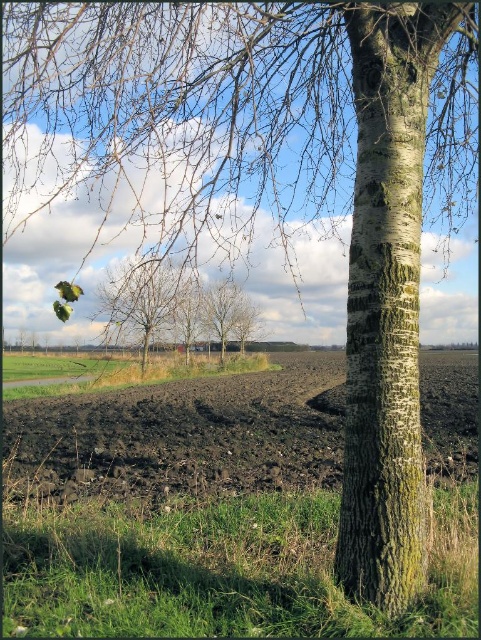
You are a farmer planning to plant a row of crops between the bare branches at center and the smooth bark tree at center. Based on the space between them, will you have enough room to plant your crops in a straight line without bending the branches?

The bare branches at center are wider than the smooth bark tree at center, so there is sufficient space between them to plant crops in a straight line without bending the branches.

You are a gardener planning to plant flowers around the barky white tree trunk at right and the bare branches at center. Which area requires more space for planting?

The bare branches at center occupy more space than the barky white tree trunk at right, so planting around the bare branches at center will require more space.

Based on the photo, you are a farmer checking the elevation of your land. You have two areas to consider for planting crops. The dark brown soil at lower left and the smooth bark tree at center. Which area is lower in elevation?

The dark brown soil at lower left has a lesser height compared to the smooth bark tree at center, so the dark brown soil at lower left is lower in elevation.